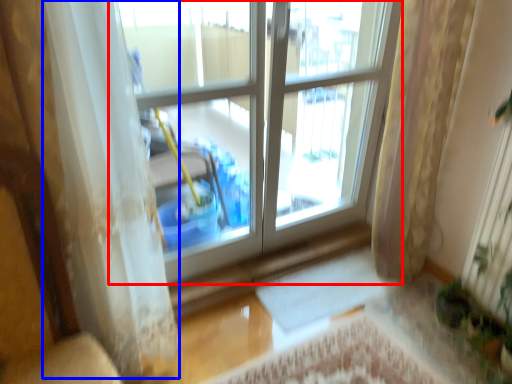
Question: Which object is closer to the camera taking this photo, window (highlighted by a red box) or curtain (highlighted by a blue box)?

Choices:
 (A) window
 (B) curtain

Answer: (B)